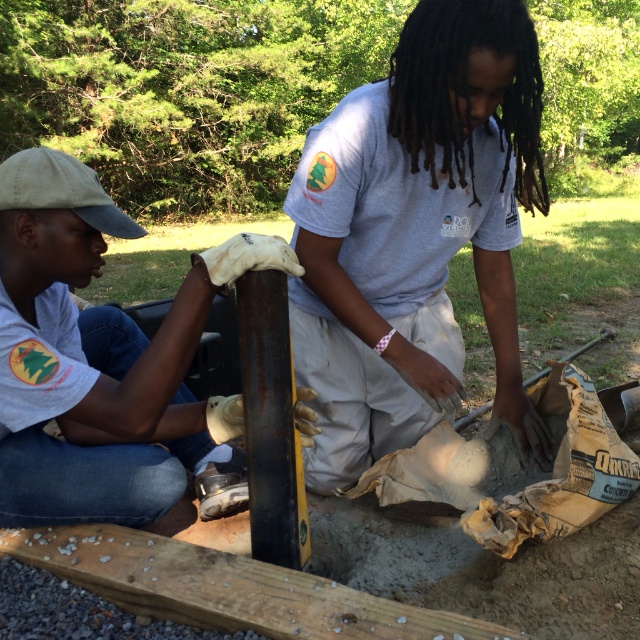
Can you confirm if smooth wooden plank at center is positioned below rusty metal pole at center?

Yes.

Which is above, smooth wooden plank at center or rusty metal pole at center?

rusty metal pole at center is higher up.

Between point (147, 582) and point (268, 307), which one is positioned in front?

Point (147, 582) is in front.

Locate an element on the screen. This screenshot has width=640, height=640. smooth wooden plank at center is located at coordinates click(227, 588).

Measure the distance between point (230, 246) and camera.

5.44 feet

Is point (76, 461) more distant than point (99, 592)?

Yes, it is behind point (99, 592).

This screenshot has height=640, width=640. Identify the location of white matte cap at upper left. (104, 362).

Who is shorter, white matte cap at upper left or smooth yellow shovel at lower center?

Standing shorter between the two is smooth yellow shovel at lower center.

Is white matte cap at upper left further to camera compared to smooth yellow shovel at lower center?

No, it is not.

This screenshot has width=640, height=640. What do you see at coordinates (104, 362) in the screenshot? I see `white matte cap at upper left` at bounding box center [104, 362].

This screenshot has height=640, width=640. What are the coordinates of `white matte cap at upper left` in the screenshot? It's located at (104, 362).